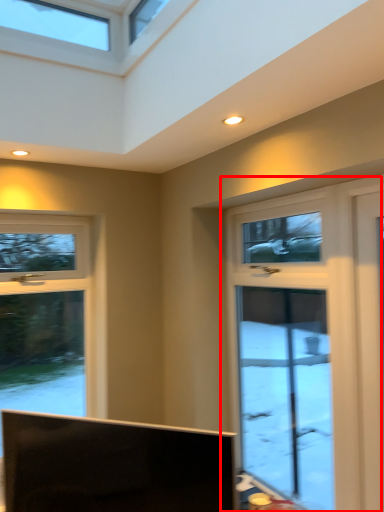
Question: From the image's perspective, what is the correct spatial relationship of window (annotated by the red box) in relation to television?

Choices:
 (A) below
 (B) above

Answer: (B)